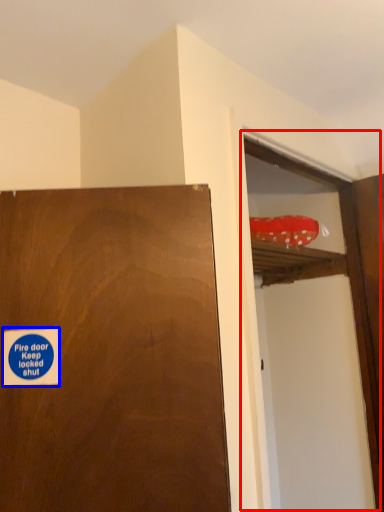
Question: Which object is further to the camera taking this photo, screen door (highlighted by a red box) or sticker (highlighted by a blue box)?

Choices:
 (A) screen door
 (B) sticker

Answer: (A)